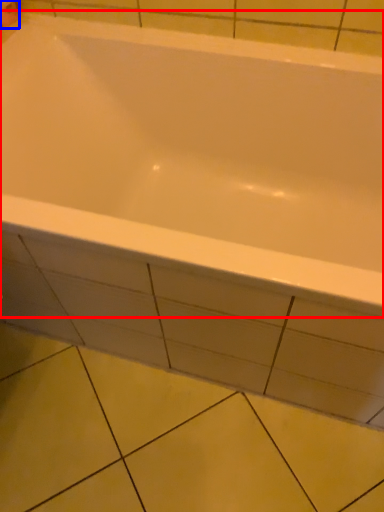
Question: Which object appears farthest to the camera in this image, bathtub (highlighted by a red box) or toilet paper (highlighted by a blue box)?

Choices:
 (A) bathtub
 (B) toilet paper

Answer: (B)